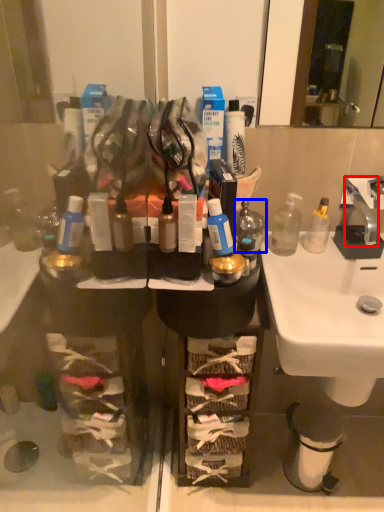
Question: Which object appears closest to the camera in this image, faucet (highlighted by a red box) or bottle (highlighted by a blue box)?

Choices:
 (A) faucet
 (B) bottle

Answer: (B)